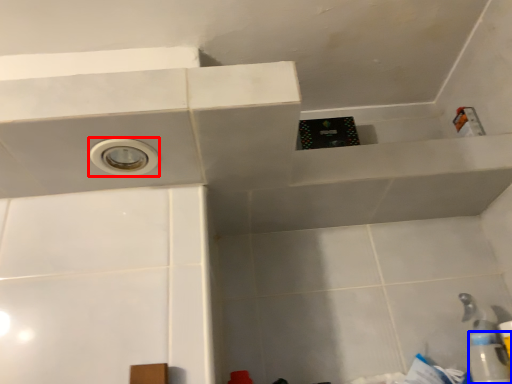
Question: Among these objects, which one is nearest to the camera, hole (highlighted by a red box) or bottle (highlighted by a blue box)?

Choices:
 (A) hole
 (B) bottle

Answer: (A)